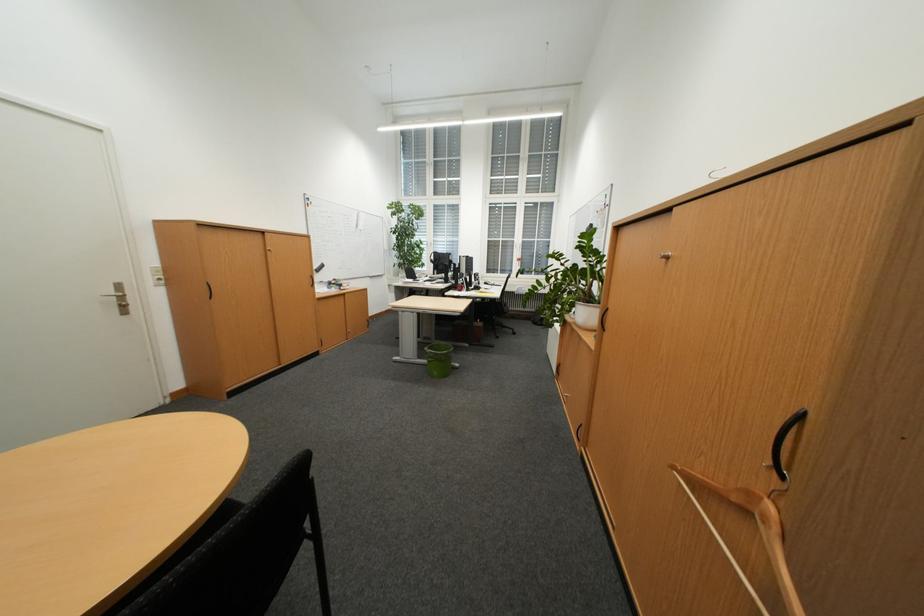
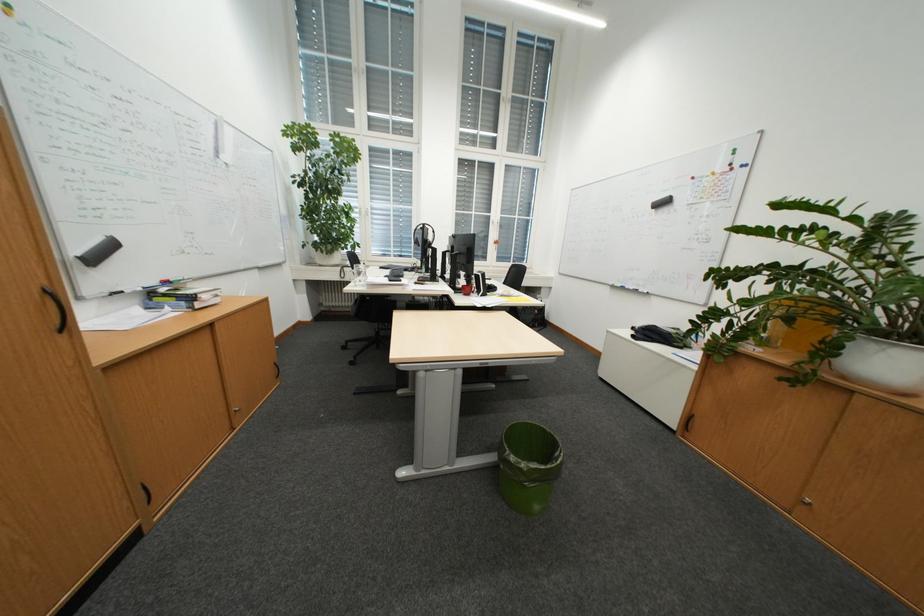
In the scene shown: Which direction would the cameraman need to move to produce the second image?

The movement direction of the cameraman is left, forward.